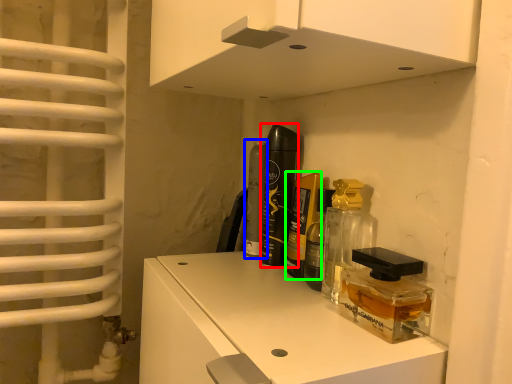
Question: Based on their relative distances, which object is nearer to perfume (highlighted by a red box)? Choose from perfume (highlighted by a blue box) and perfume (highlighted by a green box).

Choices:
 (A) perfume
 (B) perfume

Answer: (B)